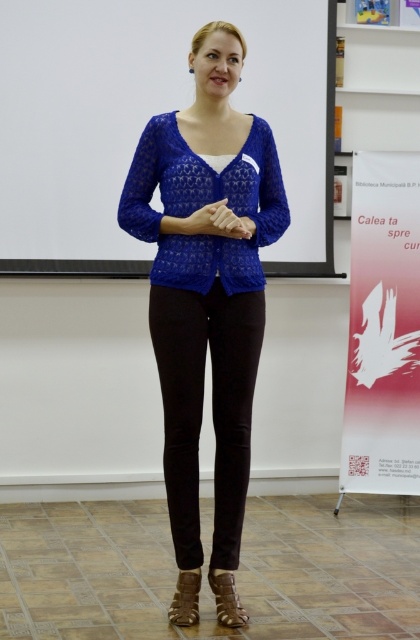
Who is taller, white matte projection screen at center or lace fabric sweater at center?

With more height is lace fabric sweater at center.

Which is more to the right, white matte projection screen at center or lace fabric sweater at center?

From the viewer's perspective, lace fabric sweater at center appears more on the right side.

Locate an element on the screen. The image size is (420, 640). white matte projection screen at center is located at coordinates (162, 134).